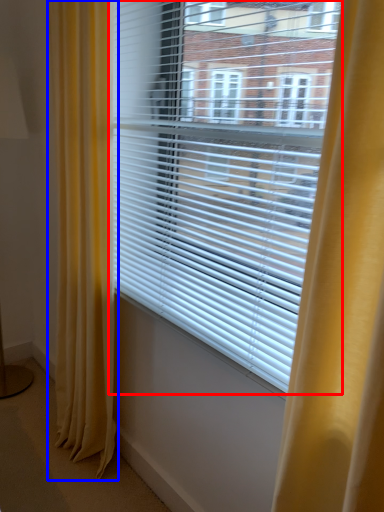
Question: Which of the following is the closest to the observer, window blind (highlighted by a red box) or curtain (highlighted by a blue box)?

Choices:
 (A) window blind
 (B) curtain

Answer: (A)